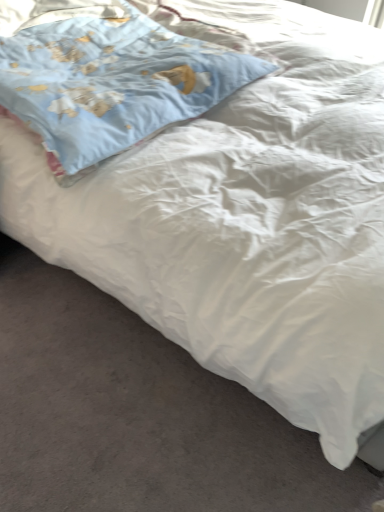
The width and height of the screenshot is (384, 512). What do you see at coordinates (111, 81) in the screenshot? I see `light blue fabric pillow at upper left` at bounding box center [111, 81].

The height and width of the screenshot is (512, 384). Identify the location of light blue fabric pillow at upper left. (111, 81).

Find the location of a particular element. light blue fabric pillow at upper left is located at coordinates (111, 81).